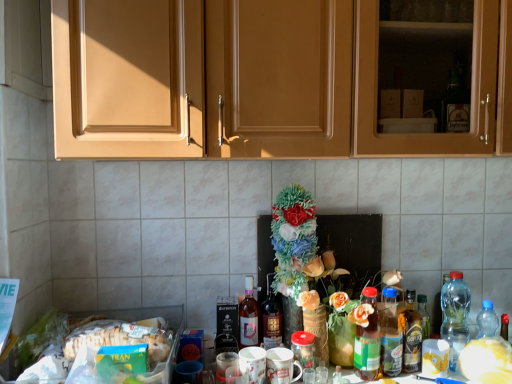
The image size is (512, 384). Describe the element at coordinates (303, 348) in the screenshot. I see `translucent glass jar at center` at that location.

Describe the element at coordinates (455, 315) in the screenshot. The image size is (512, 384). I see `transparent plastic bottle at right, positioned as the 1th bottle in right-to-left order` at that location.

Find the location of a particular element. This screenshot has height=384, width=512. translucent plastic bottles at center-right, placed as the fourth bottle when sorted from left to right is located at coordinates (390, 334).

What do you see at coordinates (390, 334) in the screenshot? I see `translucent plastic bottles at center-right, placed as the fourth bottle when sorted from left to right` at bounding box center [390, 334].

What do you see at coordinates (249, 316) in the screenshot?
I see `translucent glass bottle at center, the 6th bottle positioned from the right` at bounding box center [249, 316].

In order to face green matte box of tran at lower left, should I rotate leftwards or rightwards?

To face it directly, rotate left by 17.535 degrees.

This screenshot has height=384, width=512. In order to click on matte wood cabinets at upper center in this screenshot , I will do `click(244, 80)`.

Identify the location of translucent glass jar at center. (303, 348).

Is green glass bottle at center, the 3th bottle when ordered from left to right, aimed at transparent plastic bottle at right, positioned as the 1th bottle in right-to-left order?

No.

Is green glass bottle at center, the fourth bottle from the right, placed right next to transparent plastic bottle at right, positioned as the 1th bottle in right-to-left order?

There is a gap between green glass bottle at center, the fourth bottle from the right, and transparent plastic bottle at right, positioned as the 1th bottle in right-to-left order.

Is point (358, 333) positioned behind point (444, 306)?

No.

In the scene shown: Is the position of translucent glass bottle at center right, which appears as the second bottle when viewed from the right, less distant than that of matte wood cabinets at upper center?

No, translucent glass bottle at center right, which appears as the second bottle when viewed from the right, is behind matte wood cabinets at upper center.

From a real-world perspective, starting from the matte wood cabinets at upper center, which bottle is the 3rd one below it? Please provide its 2D coordinates.

[(411, 335)]

Considering the positions of point (408, 356) and point (238, 34), is point (408, 356) closer or farther from the camera than point (238, 34)?

Point (408, 356) appears to be farther away from the viewer than point (238, 34).

Which object is closer to the camera, green matte box of tran at lower left or green glass bottle at center, the fourth bottle from the right?

green matte box of tran at lower left is closer to the camera.

At what (x,y) coordinates should I click in order to perform the action: click on food in front of the green glass bottle at center, the 3th bottle when ordered from left to right. Please return your answer as a coordinate pair (x, y). Looking at the image, I should click on (119, 338).

Which of these two, green matte box of tran at lower left or green glass bottle at center, the 3th bottle when ordered from left to right, is bigger?

green matte box of tran at lower left is bigger.

Considering the sizes of transparent plastic bottle at right, the sixth bottle positioned from the left, and shiny dark brown bottle at center, the 5th bottle in the right-to-left sequence, in the image, is transparent plastic bottle at right, the sixth bottle positioned from the left, taller or shorter than shiny dark brown bottle at center, the 5th bottle in the right-to-left sequence,?

Considering their sizes, transparent plastic bottle at right, the sixth bottle positioned from the left, has more height than shiny dark brown bottle at center, the 5th bottle in the right-to-left sequence.

Could you tell me if transparent plastic bottle at right, the sixth bottle positioned from the left, is turned towards shiny dark brown bottle at center, which appears as the 2th bottle when viewed from the left?

No, transparent plastic bottle at right, the sixth bottle positioned from the left, does not turn towards shiny dark brown bottle at center, which appears as the 2th bottle when viewed from the left.

Does transparent plastic bottle at right, positioned as the 1th bottle in right-to-left order, contain shiny dark brown bottle at center, which appears as the 2th bottle when viewed from the left?

No.

From the image's perspective, is transparent plastic bottle at right, positioned as the 1th bottle in right-to-left order, positioned above or below shiny dark brown bottle at center, which appears as the 2th bottle when viewed from the left?

Clearly, from the image's perspective, transparent plastic bottle at right, positioned as the 1th bottle in right-to-left order, is above shiny dark brown bottle at center, which appears as the 2th bottle when viewed from the left.

Is translucent glass bottle at center, the 6th bottle positioned from the right, far from shiny dark brown bottle at center, the 5th bottle in the right-to-left sequence?

Actually, translucent glass bottle at center, the 6th bottle positioned from the right, and shiny dark brown bottle at center, the 5th bottle in the right-to-left sequence, are a little close together.

From the picture: Which is closer, (x=248, y=277) or (x=280, y=335)?

The point (x=280, y=335) is in front.

Considering the sizes of objects translucent glass bottle at center, which ranks as the first bottle in left-to-right order, and shiny dark brown bottle at center, which appears as the 2th bottle when viewed from the left, in the image provided, who is smaller, translucent glass bottle at center, which ranks as the first bottle in left-to-right order, or shiny dark brown bottle at center, which appears as the 2th bottle when viewed from the left,?

translucent glass bottle at center, which ranks as the first bottle in left-to-right order.

From the image's perspective, is green matte box of tran at lower left above or below translucent glass bottle at center right, which appears as the second bottle when viewed from the right?

Based on their image positions, green matte box of tran at lower left is located above translucent glass bottle at center right, which appears as the second bottle when viewed from the right.

Based on their sizes in the image, would you say green matte box of tran at lower left is bigger or smaller than translucent glass bottle at center right, which appears as the second bottle when viewed from the right?

green matte box of tran at lower left is bigger than translucent glass bottle at center right, which appears as the second bottle when viewed from the right.

Where is `the 1st bottle located beneath the green matte box of tran at lower left (from a real-world perspective)`? The image size is (512, 384). the 1st bottle located beneath the green matte box of tran at lower left (from a real-world perspective) is located at coordinates (411, 335).

Which of these two, green matte box of tran at lower left or translucent glass bottle at center right, which appears as the second bottle when viewed from the right, is wider?

With larger width is green matte box of tran at lower left.

Which object is positioned more to the left, green glass bottle at center, the fourth bottle from the right, or translucent glass bottle at center right, the fifth bottle viewed from the left?

From the viewer's perspective, green glass bottle at center, the fourth bottle from the right, appears more on the left side.

Between point (370, 371) and point (405, 300), which one is positioned behind?

The point (405, 300) is behind.

Considering the relative sizes of green glass bottle at center, the 3th bottle when ordered from left to right, and translucent glass bottle at center right, the fifth bottle viewed from the left, in the image provided, is green glass bottle at center, the 3th bottle when ordered from left to right, smaller than translucent glass bottle at center right, the fifth bottle viewed from the left,?

No, green glass bottle at center, the 3th bottle when ordered from left to right, is not smaller than translucent glass bottle at center right, the fifth bottle viewed from the left.

In the scene shown: From the image's perspective, is green glass bottle at center, the 3th bottle when ordered from left to right, on translucent glass bottle at center right, which appears as the second bottle when viewed from the right?

No, from the image's perspective, green glass bottle at center, the 3th bottle when ordered from left to right, is not over translucent glass bottle at center right, which appears as the second bottle when viewed from the right.

The width and height of the screenshot is (512, 384). What are the coordinates of `the 3rd bottle above the green glass bottle at center, the fourth bottle from the right (from the image's perspective)` in the screenshot? It's located at (455, 315).

At what (x,y) coordinates should I click in order to perform the action: click on the 3rd bottle to the right of the matte wood cabinets at upper center, counting from the anchor's position. Please return your answer as a coordinate pair (x, y). Looking at the image, I should click on (411, 335).

When comparing their distances from matte wood cabinets at upper center, does translucent plastic bottles at center-right, placed as the fourth bottle when sorted from left to right, or translucent glass bottle at center, which ranks as the first bottle in left-to-right order, seem further?

The object further to matte wood cabinets at upper center is translucent plastic bottles at center-right, placed as the fourth bottle when sorted from left to right.

From the image, which object appears to be farther from green matte box of tran at lower left, transparent plastic bottle at right, the sixth bottle positioned from the left, or green glass bottle at center, the fourth bottle from the right?

Among the two, transparent plastic bottle at right, the sixth bottle positioned from the left, is located further to green matte box of tran at lower left.

From the image, which object appears to be nearer to transparent plastic bottle at right, positioned as the 1th bottle in right-to-left order, translucent glass jar at center or white matte flower at center?

white matte flower at center is positioned closer to the anchor transparent plastic bottle at right, positioned as the 1th bottle in right-to-left order.

From the picture: Considering their positions, is matte wood cabinets at upper center positioned closer to transparent plastic bottle at right, the sixth bottle positioned from the left, than translucent glass bottle at center, the 6th bottle positioned from the right?

translucent glass bottle at center, the 6th bottle positioned from the right, lies closer to transparent plastic bottle at right, the sixth bottle positioned from the left, than the other object.

Looking at the image, which one is located closer to green matte box of tran at lower left, translucent glass bottle at center right, which appears as the second bottle when viewed from the right, or shiny dark brown bottle at center, which appears as the 2th bottle when viewed from the left?

The object closer to green matte box of tran at lower left is shiny dark brown bottle at center, which appears as the 2th bottle when viewed from the left.

From the image, which object appears to be nearer to transparent plastic bottle at right, the sixth bottle positioned from the left, translucent glass bottle at center, which ranks as the first bottle in left-to-right order, or translucent glass bottle at center right, which appears as the second bottle when viewed from the right?

translucent glass bottle at center right, which appears as the second bottle when viewed from the right, is positioned closer to the anchor transparent plastic bottle at right, the sixth bottle positioned from the left.

Based on their spatial positions, is transparent plastic bottle at right, the sixth bottle positioned from the left, or green glass bottle at center, the fourth bottle from the right, closer to white matte flower at center?

transparent plastic bottle at right, the sixth bottle positioned from the left, lies closer to white matte flower at center than the other object.

Considering their positions, is green glass bottle at center, the 3th bottle when ordered from left to right, positioned further to green matte box of tran at lower left than matte wood cabinets at upper center?

matte wood cabinets at upper center is positioned further to the anchor green matte box of tran at lower left.

You are a GUI agent. You are given a task and a screenshot of the screen. Output one action in this format:
    pyautogui.click(x=<x>, y=<y>)
    Task: Click on the beverage between shiny dark brown bottle at center, which appears as the 2th bottle when viewed from the left, and translucent glass bottle at center right, which appears as the second bottle when viewed from the right
    This screenshot has height=384, width=512.
    Given the screenshot: What is the action you would take?
    click(303, 348)

At what (x,y) coordinates should I click in order to perform the action: click on food between matte wood cabinets at upper center and translucent plastic bottles at center-right, placed as the fourth bottle when sorted from left to right, from top to bottom. Please return your answer as a coordinate pair (x, y). The image size is (512, 384). Looking at the image, I should click on (119, 338).

Image resolution: width=512 pixels, height=384 pixels. In order to click on beverage between translucent glass bottle at center, the 6th bottle positioned from the right, and translucent plastic bottles at center-right, the third bottle from the right, from left to right in this screenshot , I will do tap(303, 348).

Where is `beverage located between shiny dark brown bottle at center, which appears as the 2th bottle when viewed from the left, and green glass bottle at center, the fourth bottle from the right, in the left-right direction`? Image resolution: width=512 pixels, height=384 pixels. beverage located between shiny dark brown bottle at center, which appears as the 2th bottle when viewed from the left, and green glass bottle at center, the fourth bottle from the right, in the left-right direction is located at coordinates (303, 348).